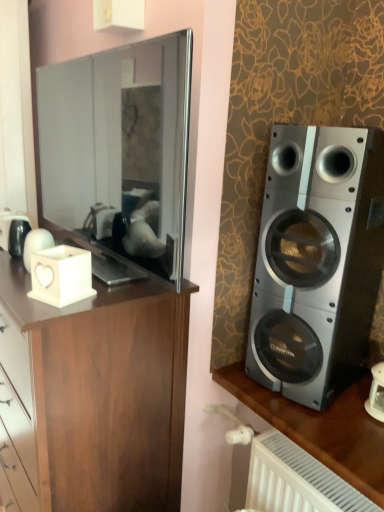
The image size is (384, 512). What do you see at coordinates (120, 150) in the screenshot?
I see `matte black mirror at left` at bounding box center [120, 150].

This screenshot has width=384, height=512. Identify the location of metallic silver speaker at right. (321, 428).

How many degrees apart are the facing directions of metallic silver speaker at right and silver metallic speaker at right?

There is a 10.2-degree angle between the facing directions of metallic silver speaker at right and silver metallic speaker at right.

Is metallic silver speaker at right facing towards silver metallic speaker at right?

No.

Does point (355, 476) lie in front of point (306, 352)?

That is True.

Between metallic silver speaker at right and silver metallic speaker at right, which one has larger width?

metallic silver speaker at right.

In the image, there is a silver metallic speaker at right. At what (x,y) coordinates should I click in order to perform the action: click on appliance below it (from the image's perspective). Please return your answer as a coordinate pair (x, y). Image resolution: width=384 pixels, height=512 pixels. Looking at the image, I should click on (61, 275).

From a real-world perspective, relative to white matte candle holder at left, is silver metallic speaker at right vertically above or below?

silver metallic speaker at right is below white matte candle holder at left.

Can you confirm if silver metallic speaker at right is bigger than white matte candle holder at left?

Yes, silver metallic speaker at right is bigger than white matte candle holder at left.

Would you say silver metallic speaker at right contains white matte candle holder at left?

No, white matte candle holder at left is located outside of silver metallic speaker at right.

Between brown wood cabinet at left and white matte candle holder at left, which one has smaller width?

white matte candle holder at left is thinner.

Considering the relative sizes of brown wood cabinet at left and white matte candle holder at left in the image provided, is brown wood cabinet at left bigger than white matte candle holder at left?

Yes, brown wood cabinet at left is bigger than white matte candle holder at left.

Considering the positions of point (155, 307) and point (82, 287), is point (155, 307) closer or farther from the camera than point (82, 287)?

Clearly, point (155, 307) is more distant from the camera than point (82, 287).

Between brown wood cabinet at left and white matte candle holder at left, which one has less height?

Standing shorter between the two is white matte candle holder at left.

Find the location of `appliance located below the matte black mirror at left (from the image's perspective)`. appliance located below the matte black mirror at left (from the image's perspective) is located at coordinates (61, 275).

From a real-world perspective, is white matte candle holder at left positioned under matte black mirror at left based on gravity?

Yes, from a real-world perspective, white matte candle holder at left is beneath matte black mirror at left.

Consider the image. Is there a large distance between white matte candle holder at left and matte black mirror at left?

No, there isn't a large distance between white matte candle holder at left and matte black mirror at left.

Would you say brown wood cabinet at left is a long distance from metallic silver speaker at right?

No, brown wood cabinet at left is not far away from metallic silver speaker at right.

Considering the relative positions of brown wood cabinet at left and metallic silver speaker at right in the image provided, is brown wood cabinet at left to the left or to the right of metallic silver speaker at right?

In the image, brown wood cabinet at left appears on the left side of metallic silver speaker at right.

From the image's perspective, which one is positioned higher, brown wood cabinet at left or metallic silver speaker at right?

brown wood cabinet at left is shown above in the image.

Does matte black mirror at left turn towards metallic silver speaker at right?

No, matte black mirror at left is not aimed at metallic silver speaker at right.

Is matte black mirror at left outside of metallic silver speaker at right?

That's correct, matte black mirror at left is outside of metallic silver speaker at right.

Identify the location of desk on the right of the matte black mirror at left. The image size is (384, 512). (321, 428).

Does white matte candle holder at left have a larger size compared to brown wood cabinet at left?

No, white matte candle holder at left is not bigger than brown wood cabinet at left.

Considering the positions of objects white matte candle holder at left and brown wood cabinet at left in the image provided, who is more to the left, white matte candle holder at left or brown wood cabinet at left?

brown wood cabinet at left.

Is white matte candle holder at left inside the boundaries of brown wood cabinet at left, or outside?

white matte candle holder at left is located beyond the bounds of brown wood cabinet at left.

Based on the photo, considering the relative sizes of white matte candle holder at left and brown wood cabinet at left in the image provided, is white matte candle holder at left taller than brown wood cabinet at left?

No.

At what (x,y) coordinates should I click in order to perform the action: click on desk in front of the silver metallic speaker at right. Please return your answer as a coordinate pair (x, y). The height and width of the screenshot is (512, 384). Looking at the image, I should click on (321, 428).

At what (x,y) coordinates should I click in order to perform the action: click on appliance above the silver metallic speaker at right (from a real-world perspective). Please return your answer as a coordinate pair (x, y). Looking at the image, I should click on (61, 275).

From the image, which object appears to be farther from brown wood cabinet at left, metallic silver speaker at right or silver metallic speaker at right?

Based on the image, silver metallic speaker at right appears to be further to brown wood cabinet at left.

Based on their spatial positions, is white matte candle holder at left or silver metallic speaker at right closer to brown wood cabinet at left?

Based on the image, white matte candle holder at left appears to be nearer to brown wood cabinet at left.

Considering their positions, is white matte candle holder at left positioned further to matte black mirror at left than silver metallic speaker at right?

Based on the image, silver metallic speaker at right appears to be further to matte black mirror at left.

From the image, which object appears to be nearer to brown wood cabinet at left, matte black mirror at left or white matte candle holder at left?

white matte candle holder at left is positioned closer to the anchor brown wood cabinet at left.

Based on their spatial positions, is matte black mirror at left or silver metallic speaker at right further from white matte candle holder at left?

The object further to white matte candle holder at left is silver metallic speaker at right.

Considering their positions, is matte black mirror at left positioned further to metallic silver speaker at right than silver metallic speaker at right?

matte black mirror at left.

When comparing their distances from white matte candle holder at left, does brown wood cabinet at left or silver metallic speaker at right seem further?

silver metallic speaker at right is further to white matte candle holder at left.

Which object lies nearer to the anchor point white matte candle holder at left, silver metallic speaker at right or matte black mirror at left?

Among the two, matte black mirror at left is located nearer to white matte candle holder at left.

At what (x,y) coordinates should I click in order to perform the action: click on appliance located between brown wood cabinet at left and metallic silver speaker at right in the left-right direction. Please return your answer as a coordinate pair (x, y). The height and width of the screenshot is (512, 384). Looking at the image, I should click on (61, 275).

This screenshot has height=512, width=384. What are the coordinates of `cabinetry between matte black mirror at left and metallic silver speaker at right vertically` in the screenshot? It's located at (92, 396).

You are a GUI agent. You are given a task and a screenshot of the screen. Output one action in this format:
    pyautogui.click(x=<x>, y=<y>)
    Task: Click on the appliance between matte black mirror at left and metallic silver speaker at right in the vertical direction
    
    Given the screenshot: What is the action you would take?
    pyautogui.click(x=61, y=275)

Where is `appliance between silver metallic speaker at right and metallic silver speaker at right in the up-down direction`? This screenshot has width=384, height=512. appliance between silver metallic speaker at right and metallic silver speaker at right in the up-down direction is located at coordinates (61, 275).